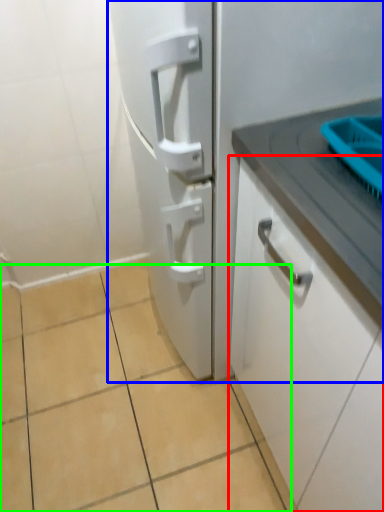
Question: Considering the real-world distances, which object is closest to cabinetry (highlighted by a red box)? refrigerator (highlighted by a blue box) or ceramic tile (highlighted by a green box).

Choices:
 (A) refrigerator
 (B) ceramic tile

Answer: (A)